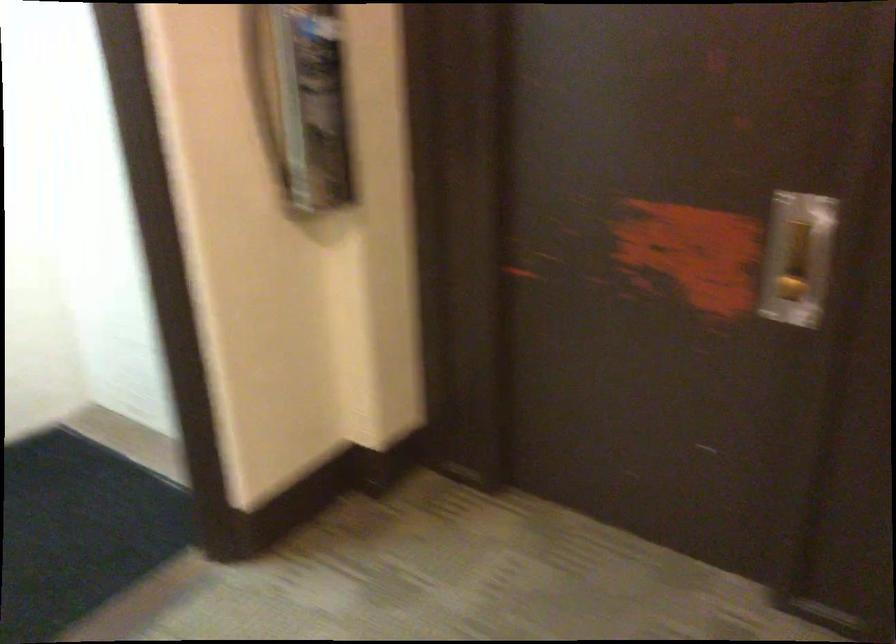
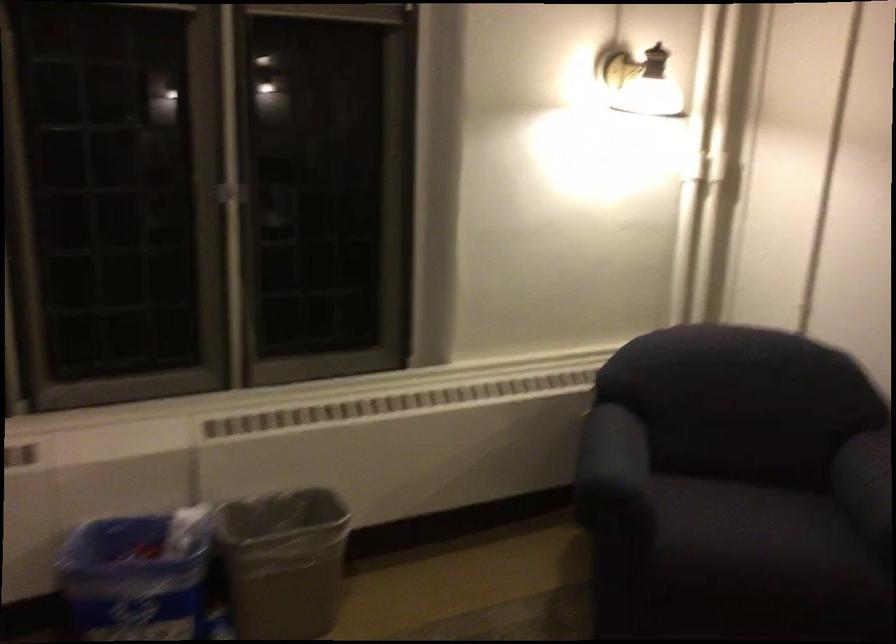
Which direction would the cameraman need to move to produce the second image?

The movement direction of the cameraman is left, backward.